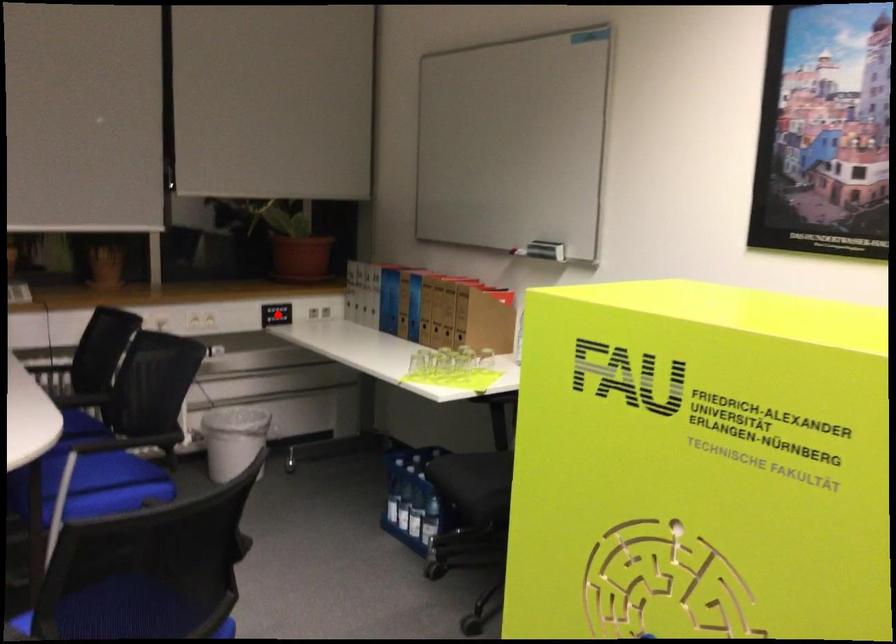
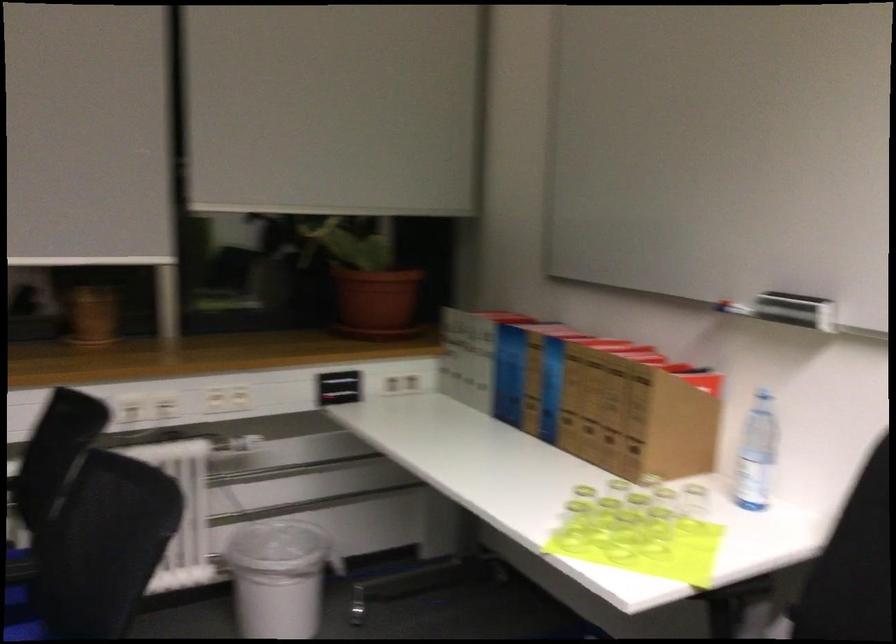
Question: I am providing you with two images of the same scene from different viewpoints. In image1, a red point is highlighted. Considering the same 3D point in image2, which of the following is correct?

Choices:
 (A) It is closer
 (B) It is farther

Answer: (A)